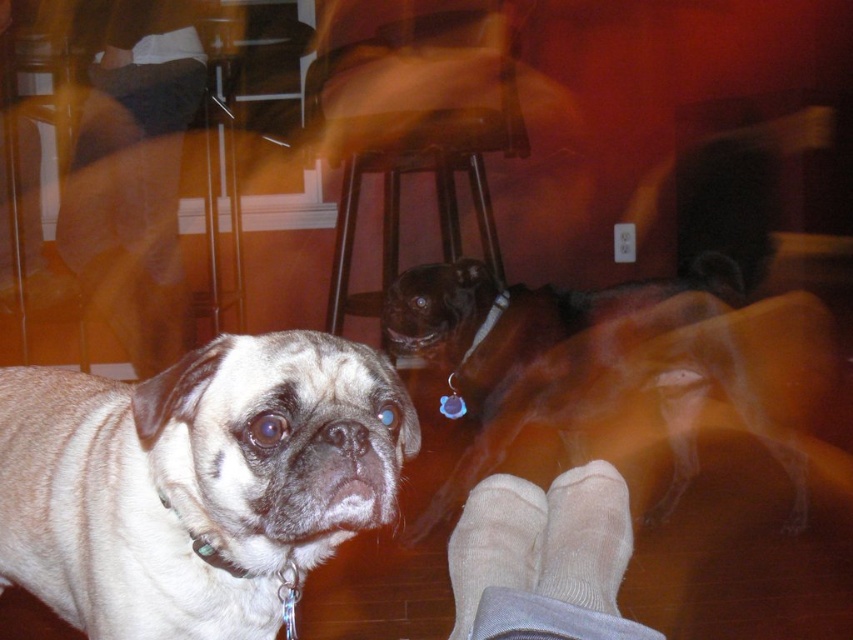
Question: Which point is closer to the camera taking this photo?

Choices:
 (A) (84, 141)
 (B) (587, 579)
 (C) (608, 605)

Answer: (C)

Question: Among these objects, which one is nearest to the camera?

Choices:
 (A) brown fabric pants at left
 (B) white soft sock at lower center
 (C) brown wooden stool at center

Answer: (B)

Question: Based on their relative distances, which object is nearer to the brown shiny dog at center?

Choices:
 (A) brown fabric pants at left
 (B) brown wooden stool at center
 (C) white soft sock at lower center
 (D) beige cotton socks at lower right

Answer: (C)

Question: Can you confirm if brown fabric pants at left is bigger than white soft sock at lower center?

Choices:
 (A) yes
 (B) no

Answer: (A)

Question: Does light beige fur at center appear on the left side of beige soft socks at lower center?

Choices:
 (A) yes
 (B) no

Answer: (A)

Question: Can you confirm if brown shiny dog at center is wider than brown wooden stool at center?

Choices:
 (A) no
 (B) yes

Answer: (B)